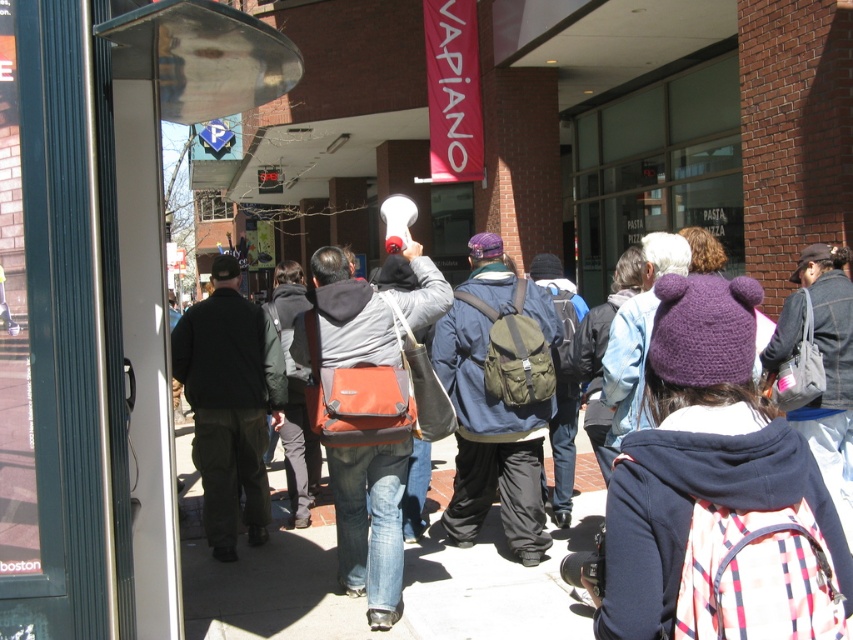
Based on the photo, you are standing at the entrance of the building with the red brick facade and need to locate the orange fabric messenger bag at center. According to the spatial coordinates provided, where should you look to find it?

The orange fabric messenger bag at center is located at the coordinates point (370, 524), which is to the right and slightly above the center point of the image.

You are a delivery person who needs to retrieve your orange fabric messenger bag at center from under the black cotton jacket at center. Can you easily access it without moving the jacket?

The orange fabric messenger bag at center is positioned under the black cotton jacket at center, so you cannot easily access it without moving the jacket.